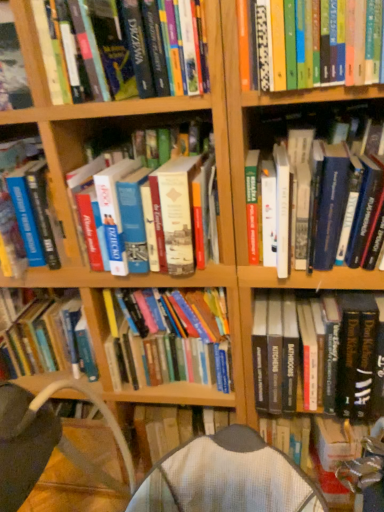
Question: Considering the relative positions of hardcover book at center, which appears as the 6th book when viewed from the left, and hardcover book at center, arranged as the 4th book when viewed from the right, in the image provided, is hardcover book at center, which appears as the 6th book when viewed from the left, behind hardcover book at center, arranged as the 4th book when viewed from the right,?

Choices:
 (A) yes
 (B) no

Answer: (B)

Question: Considering the relative sizes of hardcover book at center, which appears as the 2th book when viewed from the right, and hardcover book at center, arranged as the 4th book when viewed from the right, in the image provided, is hardcover book at center, which appears as the 2th book when viewed from the right, smaller than hardcover book at center, arranged as the 4th book when viewed from the right,?

Choices:
 (A) yes
 (B) no

Answer: (A)

Question: From the image's perspective, does hardcover book at center, which appears as the 2th book when viewed from the right, appear lower than hardcover book at center, arranged as the 4th book when viewed from the right?

Choices:
 (A) yes
 (B) no

Answer: (B)

Question: Is hardcover book at center, which appears as the 2th book when viewed from the right, aimed at hardcover book at center, arranged as the 4th book when viewed from the right?

Choices:
 (A) no
 (B) yes

Answer: (A)

Question: From the image's perspective, is hardcover book at center, which appears as the 2th book when viewed from the right, above hardcover book at center, arranged as the 4th book when viewed from the right?

Choices:
 (A) no
 (B) yes

Answer: (B)

Question: Considering the positions of hardcover book at center, which is the fifth book from right to left, and hardcover book at center, which appears as the 2th book when viewed from the right, in the image, is hardcover book at center, which is the fifth book from right to left, bigger or smaller than hardcover book at center, which appears as the 2th book when viewed from the right,?

Choices:
 (A) big
 (B) small

Answer: (A)

Question: From a real-world perspective, is hardcover book at center, which is the fifth book from right to left, above or below hardcover book at center, which appears as the 6th book when viewed from the left?

Choices:
 (A) below
 (B) above

Answer: (A)

Question: In terms of height, does hardcover book at center, which is the fifth book from right to left, look taller or shorter compared to hardcover book at center, which appears as the 2th book when viewed from the right?

Choices:
 (A) tall
 (B) short

Answer: (B)

Question: Do you think hardcover book at center, which is the fifth book from right to left, is within hardcover book at center, which appears as the 2th book when viewed from the right, or outside of it?

Choices:
 (A) outside
 (B) inside

Answer: (A)

Question: Is point (365, 414) positioned closer to the camera than point (39, 247)?

Choices:
 (A) closer
 (B) farther

Answer: (B)

Question: Looking at their shapes, would you say hardcover book at lower right, acting as the seventh book starting from the left, is wider or thinner than hardcover book at left, the seventh book from the right?

Choices:
 (A) thin
 (B) wide

Answer: (A)

Question: Considering the positions of hardcover book at lower right, the 1th book positioned from the right, and hardcover book at left, the seventh book from the right, in the image, is hardcover book at lower right, the 1th book positioned from the right, bigger or smaller than hardcover book at left, the seventh book from the right,?

Choices:
 (A) big
 (B) small

Answer: (A)

Question: Considering the relative positions of hardcover book at lower right, acting as the seventh book starting from the left, and hardcover book at left, the first book viewed from the left, in the image provided, is hardcover book at lower right, acting as the seventh book starting from the left, to the left or to the right of hardcover book at left, the first book viewed from the left,?

Choices:
 (A) left
 (B) right

Answer: (B)

Question: From the image's perspective, is hardcover book at lower right, the 1th book positioned from the right, positioned above or below hardcover book at upper right, which is the third book in right-to-left order?

Choices:
 (A) above
 (B) below

Answer: (B)

Question: Considering the positions of hardcover book at lower right, the 1th book positioned from the right, and hardcover book at upper right, which is the third book in right-to-left order, in the image, is hardcover book at lower right, the 1th book positioned from the right, wider or thinner than hardcover book at upper right, which is the third book in right-to-left order,?

Choices:
 (A) thin
 (B) wide

Answer: (A)